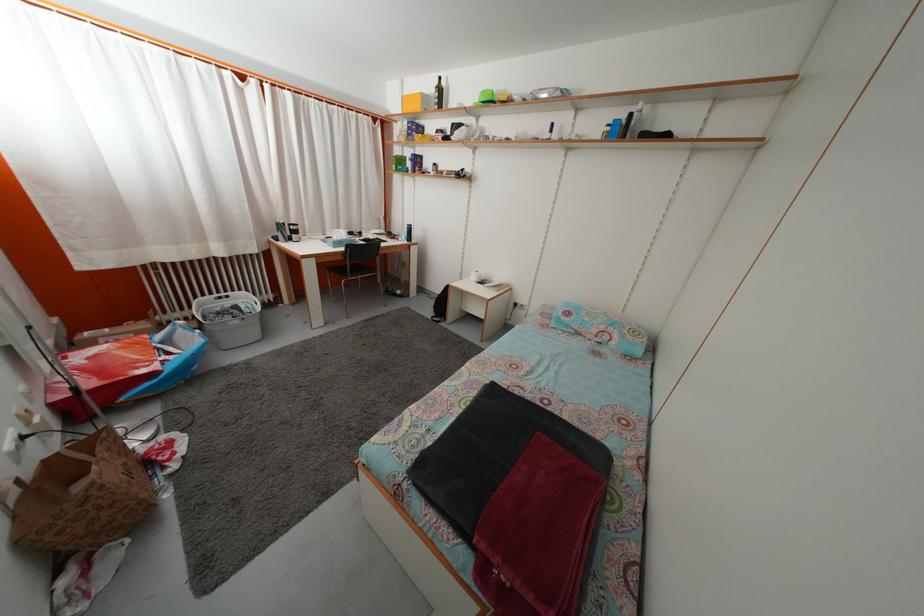
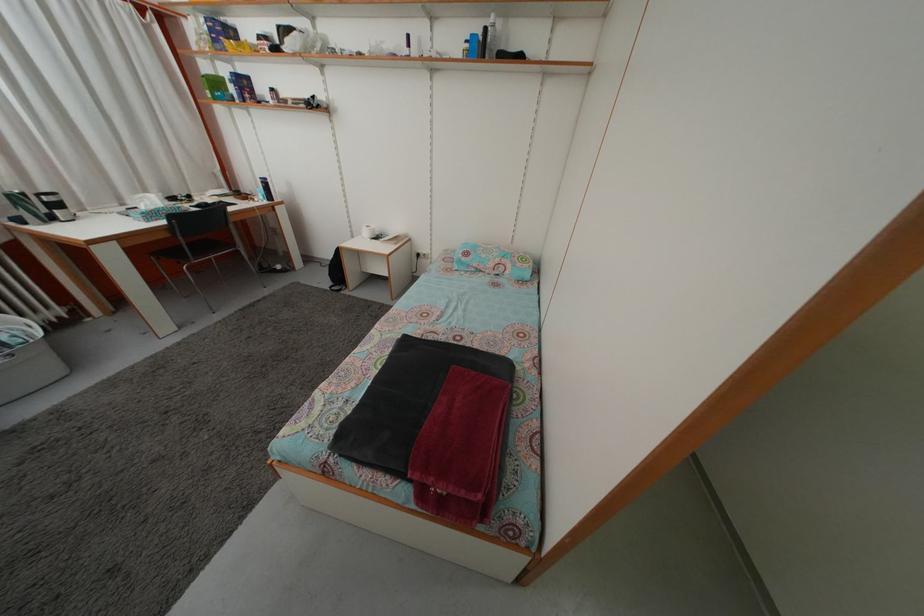
Find the pixel in the second image that matches [407,168] in the first image.

(223, 91)